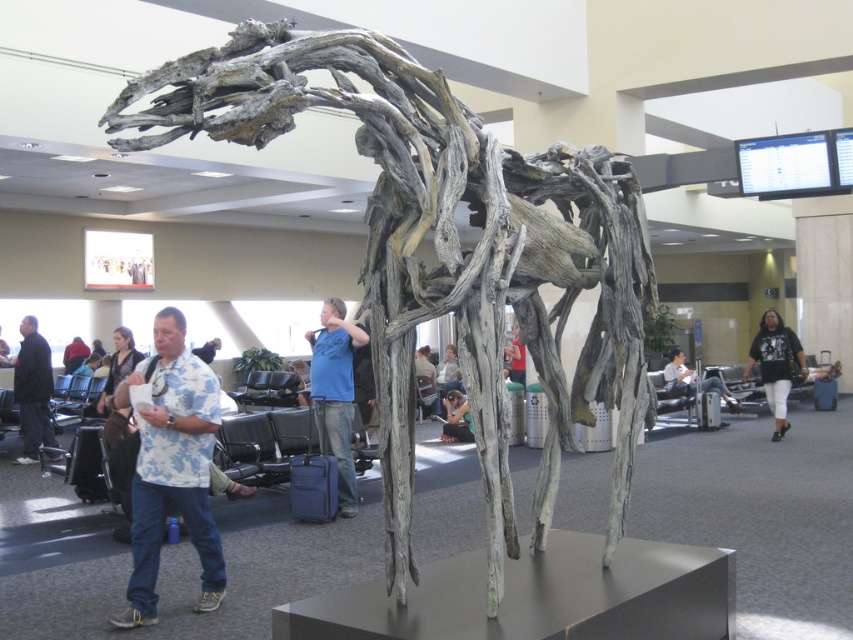
You are a photographer who wants to capture both the driftwood sculpture at center and the matte black camera at center in the same frame. Based on their sizes, which object should you focus on first to ensure both fit in the shot?

The driftwood sculpture at center is larger in size than the matte black camera at center, so you should focus on the driftwood sculpture at center first to accommodate its larger size in the frame.

You are standing at the entrance of the airport terminal and want to locate the driftwood sculpture at center. According to the coordinates provided, in which direction should you walk to reach it?

The driftwood sculpture at center is located at coordinates point (445, 252). Since the coordinate system starts at the bottom left corner, you should walk towards the upper right direction to reach it.

You are a traveler looking for a seat in the airport terminal. You see a white floral shirt at center and a dark gray fabric jacket at left. Which one is closer to you?

Result: The white floral shirt at center is closer to you because it is in front of the dark gray fabric jacket at left.